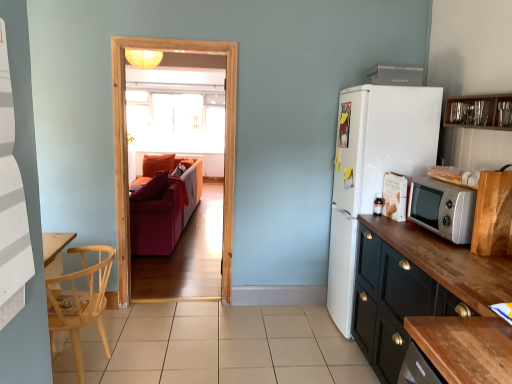
Where is `free spot to the left of silver metallic microwave oven at right`? This screenshot has height=384, width=512. free spot to the left of silver metallic microwave oven at right is located at coordinates (402, 233).